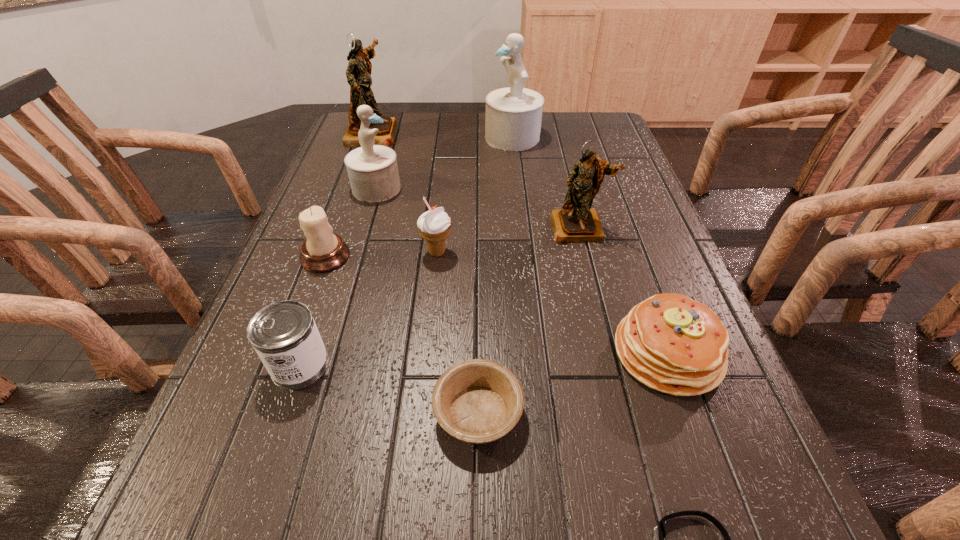
Locate an element on the screen. the farther white figurine is located at coordinates (513, 117).

The image size is (960, 540). Identify the location of the bigger white figurine. (513, 117).

Find the location of a particular element. the left gold figurine is located at coordinates (358, 73).

You are a GUI agent. You are given a task and a screenshot of the screen. Output one action in this format:
    pyautogui.click(x=<x>, y=<y>)
    Task: Click on the farther gold figurine
    
    Given the screenshot: What is the action you would take?
    pyautogui.click(x=358, y=73)

Identify the location of the left white figurine. (373, 172).

At what (x,y) coordinates should I click in order to perform the action: click on the smaller white figurine. Please return your answer as a coordinate pair (x, y). The image size is (960, 540). Looking at the image, I should click on (373, 172).

I want to click on the nearer gold figurine, so click(576, 222).

Where is `the right gold figurine`? the right gold figurine is located at coordinates (576, 222).

Locate an element on the screen. candle holder is located at coordinates [x=322, y=251].

The width and height of the screenshot is (960, 540). In order to click on icecream in this screenshot , I will do `click(434, 226)`.